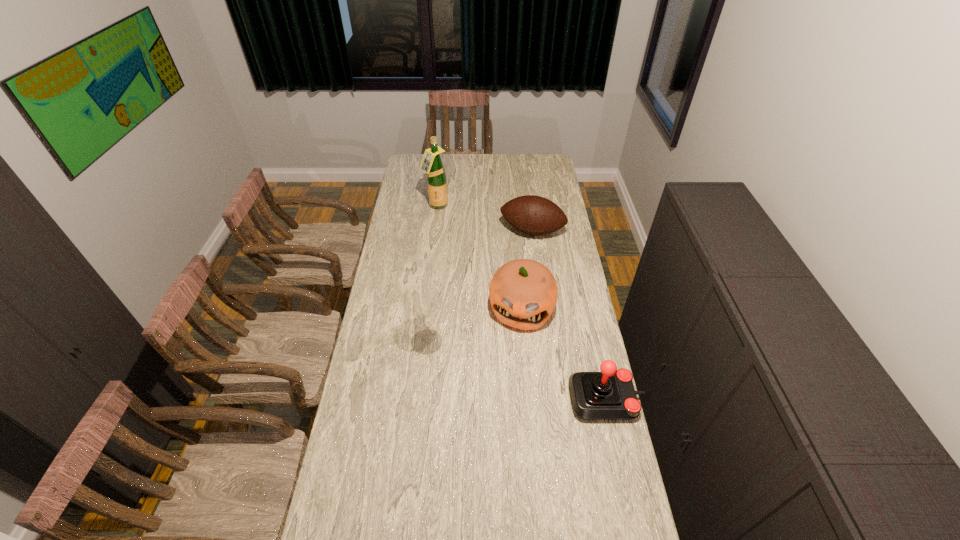
At what (x,y) coordinates should I click in order to perform the action: click on blank region between the flute glass and the football. Please return your answer as a coordinate pair (x, y). Image resolution: width=960 pixels, height=540 pixels. Looking at the image, I should click on (479, 286).

Identify the location of free space between the nearest object and the flute glass. This screenshot has height=540, width=960. (516, 370).

At what (x,y) coordinates should I click in order to perform the action: click on vacant space that's between the farthest object and the flute glass. Please return your answer as a coordinate pair (x, y). The image size is (960, 540). Looking at the image, I should click on (431, 274).

Where is `free spot between the flute glass and the second farthest object`? The image size is (960, 540). free spot between the flute glass and the second farthest object is located at coordinates (479, 286).

Locate which object ranks in proximity to the football. Please provide its 2D coordinates. Your answer should be formatted as a tuple, i.e. [(x, y)], where the tuple contains the x and y coordinates of a point satisfying the conditions above.

[(431, 163)]

This screenshot has width=960, height=540. I want to click on object that can be found as the fourth closest to the joystick, so click(x=431, y=163).

This screenshot has width=960, height=540. In order to click on blank area in the image that satisfies the following two spatial constraints: 1. on the front side of the nearest object; 2. on the base of the fourth nearest object in this screenshot , I will do `click(554, 399)`.

The height and width of the screenshot is (540, 960). I want to click on vacant region that satisfies the following two spatial constraints: 1. on the back side of the pumpkin; 2. on the left side of the football, so click(x=515, y=231).

Image resolution: width=960 pixels, height=540 pixels. Identify the location of free location that satisfies the following two spatial constraints: 1. on the front side of the second farthest object; 2. on the left side of the farthest object. (433, 231).